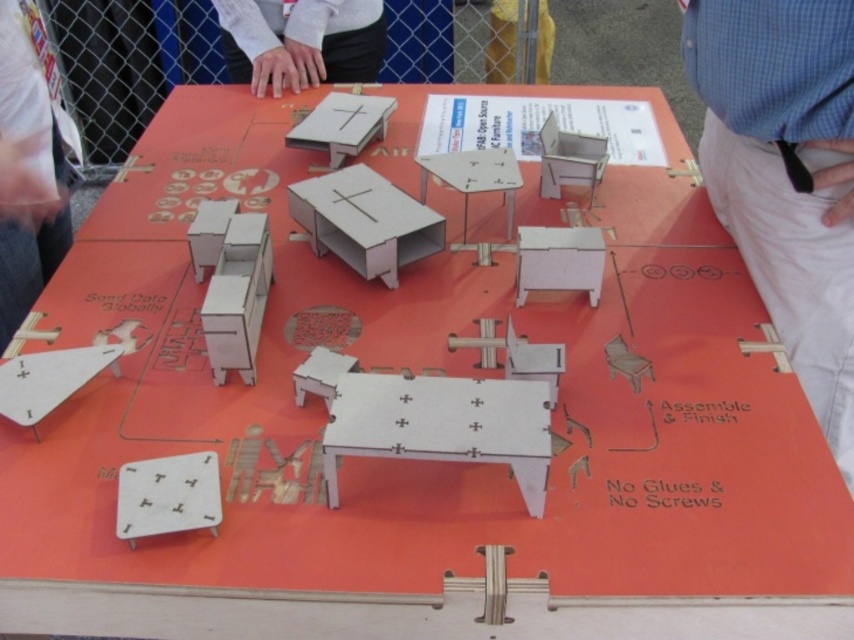
From the picture: You are a customer looking at the display table and want to place a new item between the white matte shirt at upper center and the matte wood table at center. Where should you position it?

The white matte shirt at upper center is to the left of the matte wood table at center, so you should place the new item between them on the right side of the white matte shirt and the left side of the matte wood table at center.